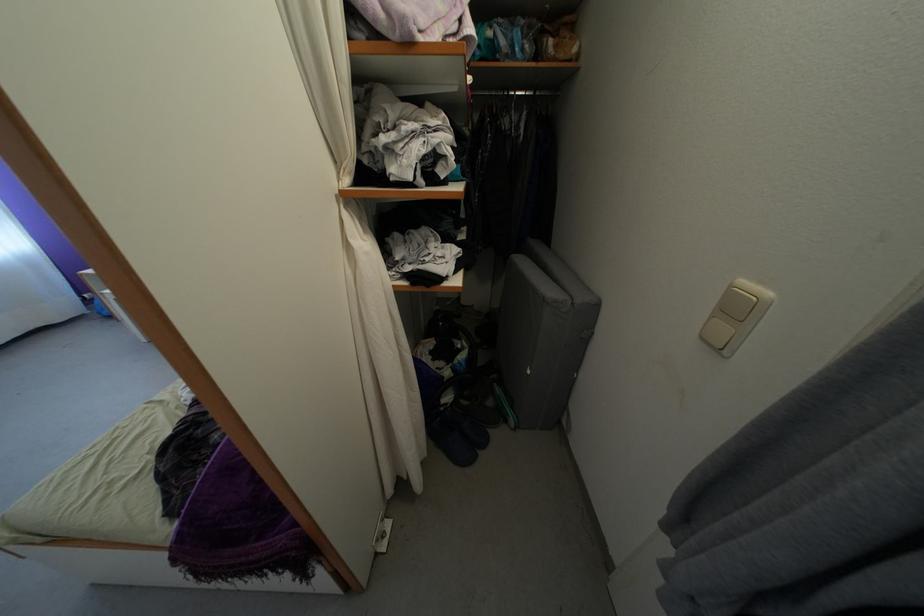
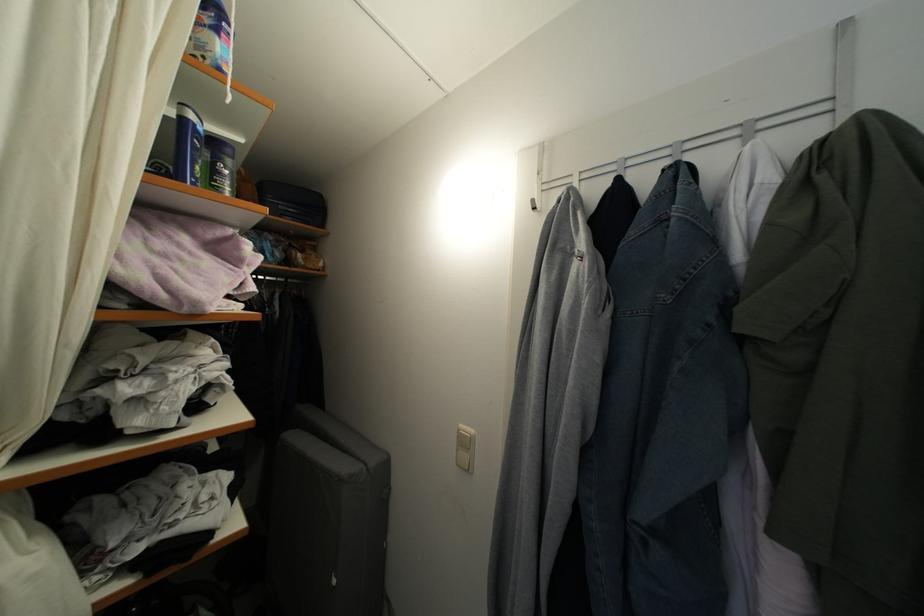
Locate, in the second image, the point that corresponds to (x=535, y=378) in the first image.

(339, 588)